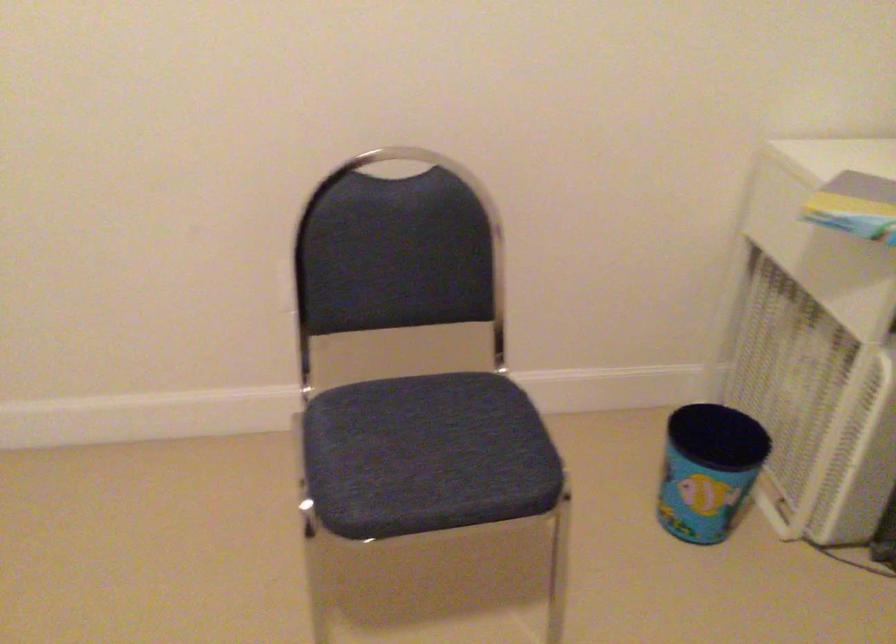
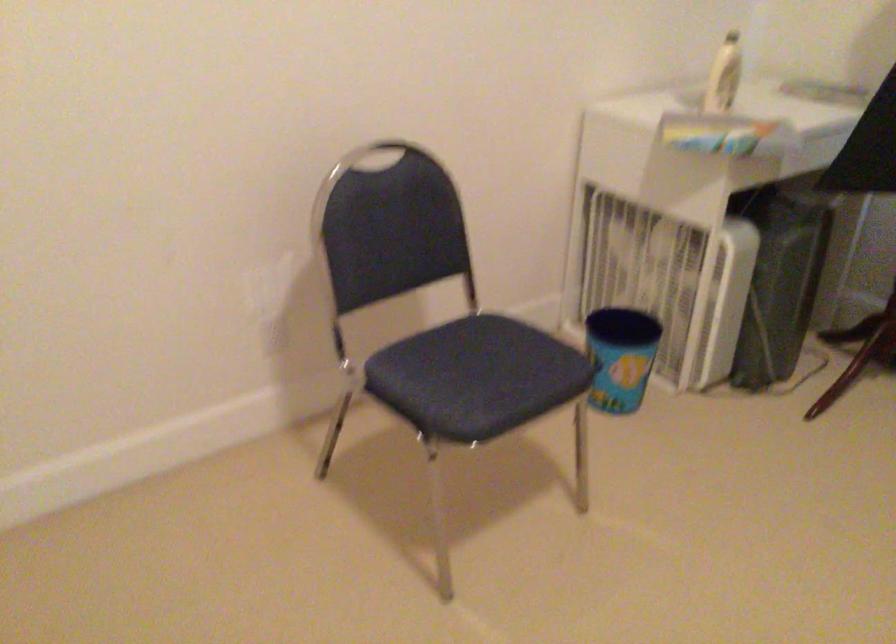
Locate, in the second image, the point that corresponds to pixel 462 161 in the first image.

(377, 156)